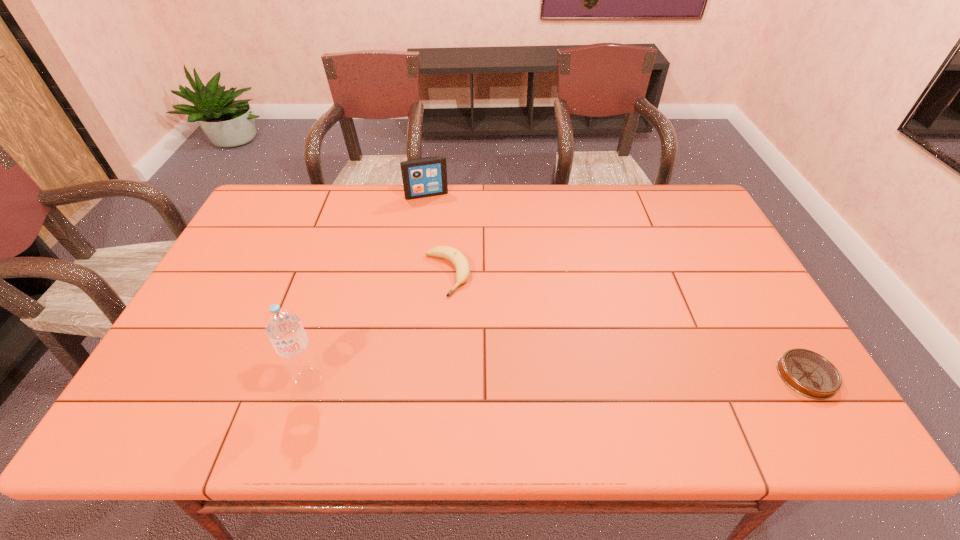
Find the location of a particular element. This screenshot has height=540, width=960. vacant region located 0.150m at the stem of the third nearest object is located at coordinates (481, 335).

This screenshot has width=960, height=540. Identify the location of free spot located at the stem of the third nearest object. (474, 323).

The width and height of the screenshot is (960, 540). What are the coordinates of `free space located at the stem of the third nearest object` in the screenshot? It's located at (516, 388).

Image resolution: width=960 pixels, height=540 pixels. What are the coordinates of `free region located on the front screen of the third shortest object` in the screenshot? It's located at (452, 264).

The width and height of the screenshot is (960, 540). Find the location of `free location located 0.080m on the front screen of the third shortest object`. free location located 0.080m on the front screen of the third shortest object is located at coordinates (436, 214).

Identify the location of vacant space located 0.330m on the front screen of the third shortest object. The image size is (960, 540). coord(452,264).

You are a GUI agent. You are given a task and a screenshot of the screen. Output one action in this format:
    pyautogui.click(x=<x>, y=<y>)
    Task: Click on the object situated at the far edge
    The height and width of the screenshot is (540, 960).
    Given the screenshot: What is the action you would take?
    pyautogui.click(x=424, y=177)

You are a GUI agent. You are given a task and a screenshot of the screen. Output one action in this format:
    pyautogui.click(x=<x>, y=<y>)
    Task: Click on the water bottle that is positioned at the near edge
    
    Given the screenshot: What is the action you would take?
    pyautogui.click(x=282, y=325)

Where is `compass that is positioned at the near edge`? compass that is positioned at the near edge is located at coordinates (808, 373).

I want to click on object that is at the right edge, so click(808, 373).